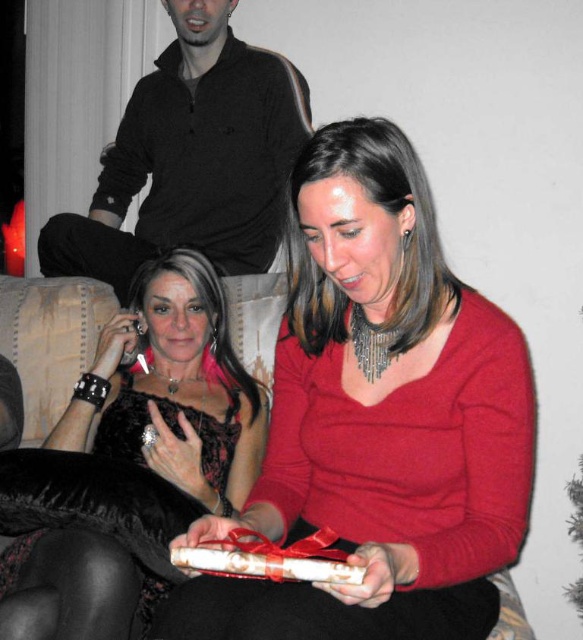
Question: Which object appears farthest from the camera in this image?

Choices:
 (A) matte red sweater at center
 (B) white paper gift at center
 (C) velvet black dress at left
 (D) black matte shirt at upper center

Answer: (D)

Question: Which point is farther from the camera taking this photo?

Choices:
 (A) (317, 392)
 (B) (170, 552)
 (C) (254, 211)
 (D) (150, 454)

Answer: (C)

Question: Which point is closer to the camera taking this photo?

Choices:
 (A) (261, 548)
 (B) (254, 164)

Answer: (A)

Question: Does black matte shirt at upper center have a lesser width compared to white paper gift at center?

Choices:
 (A) no
 (B) yes

Answer: (A)

Question: Is matte red sweater at center above velvet black dress at left?

Choices:
 (A) no
 (B) yes

Answer: (B)

Question: Is velvet black dress at left thinner than black matte shirt at upper center?

Choices:
 (A) yes
 (B) no

Answer: (A)